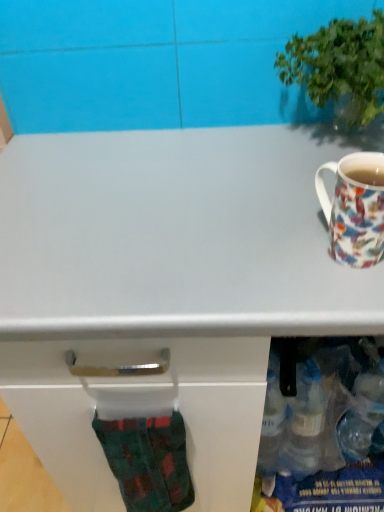
Question: Does green plaid sock at lower left have a lesser height compared to green leafy plant at upper right?

Choices:
 (A) yes
 (B) no

Answer: (B)

Question: From a real-world perspective, is green plaid sock at lower left over green leafy plant at upper right?

Choices:
 (A) no
 (B) yes

Answer: (A)

Question: Is green plaid sock at lower left with green leafy plant at upper right?

Choices:
 (A) no
 (B) yes

Answer: (A)

Question: Is there a large distance between green plaid sock at lower left and green leafy plant at upper right?

Choices:
 (A) no
 (B) yes

Answer: (A)

Question: Considering the relative sizes of green plaid sock at lower left and green leafy plant at upper right in the image provided, is green plaid sock at lower left smaller than green leafy plant at upper right?

Choices:
 (A) yes
 (B) no

Answer: (A)

Question: Considering the positions of point (365, 98) and point (99, 424), is point (365, 98) closer or farther from the camera than point (99, 424)?

Choices:
 (A) farther
 (B) closer

Answer: (A)

Question: From the image's perspective, is green leafy plant at upper right located above or below green plaid sock at lower left?

Choices:
 (A) below
 (B) above

Answer: (B)

Question: Is green leafy plant at upper right bigger or smaller than green plaid sock at lower left?

Choices:
 (A) big
 (B) small

Answer: (A)

Question: In the image, is green leafy plant at upper right positioned in front of or behind green plaid sock at lower left?

Choices:
 (A) behind
 (B) front

Answer: (B)

Question: Is porcelain floral mug at right taller or shorter than green plaid sock at lower left?

Choices:
 (A) short
 (B) tall

Answer: (A)

Question: Considering the positions of point (352, 265) and point (130, 451), is point (352, 265) closer or farther from the camera than point (130, 451)?

Choices:
 (A) farther
 (B) closer

Answer: (B)

Question: Considering their positions, is porcelain floral mug at right located in front of or behind green plaid sock at lower left?

Choices:
 (A) front
 (B) behind

Answer: (A)

Question: Based on their positions, is porcelain floral mug at right located to the left or right of green plaid sock at lower left?

Choices:
 (A) left
 (B) right

Answer: (B)

Question: Do you think green plaid sock at lower left is within porcelain floral mug at right, or outside of it?

Choices:
 (A) inside
 (B) outside

Answer: (B)

Question: Considering their positions, is green plaid sock at lower left located in front of or behind porcelain floral mug at right?

Choices:
 (A) behind
 (B) front

Answer: (A)